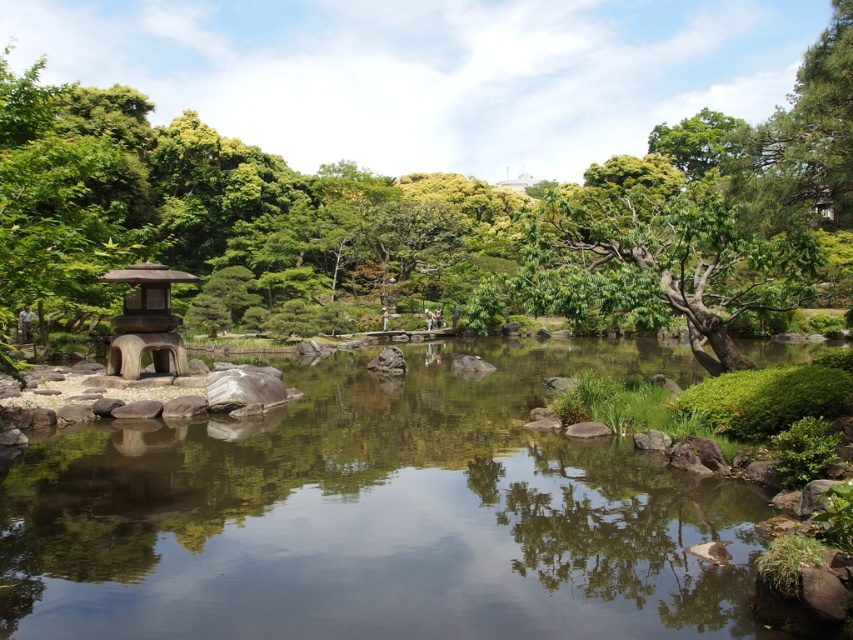
Question: Does smooth stone stream at center appear on the right side of smooth bark tree at left?

Choices:
 (A) no
 (B) yes

Answer: (A)

Question: Is smooth bark tree at left above green leafy tree at center-right?

Choices:
 (A) no
 (B) yes

Answer: (B)

Question: Among these objects, which one is nearest to the camera?

Choices:
 (A) wooden lantern at left
 (B) smooth bark tree at left

Answer: (B)

Question: Which of the following is the farthest from the observer?

Choices:
 (A) (695, 244)
 (B) (78, 202)
 (C) (115, 348)

Answer: (B)

Question: Can you confirm if green leafy tree at center-right is thinner than wooden lantern at left?

Choices:
 (A) yes
 (B) no

Answer: (B)

Question: Estimate the real-world distances between objects in this image. Which object is farther from the smooth stone stream at center?

Choices:
 (A) wooden lantern at left
 (B) green leafy tree at center-right

Answer: (B)